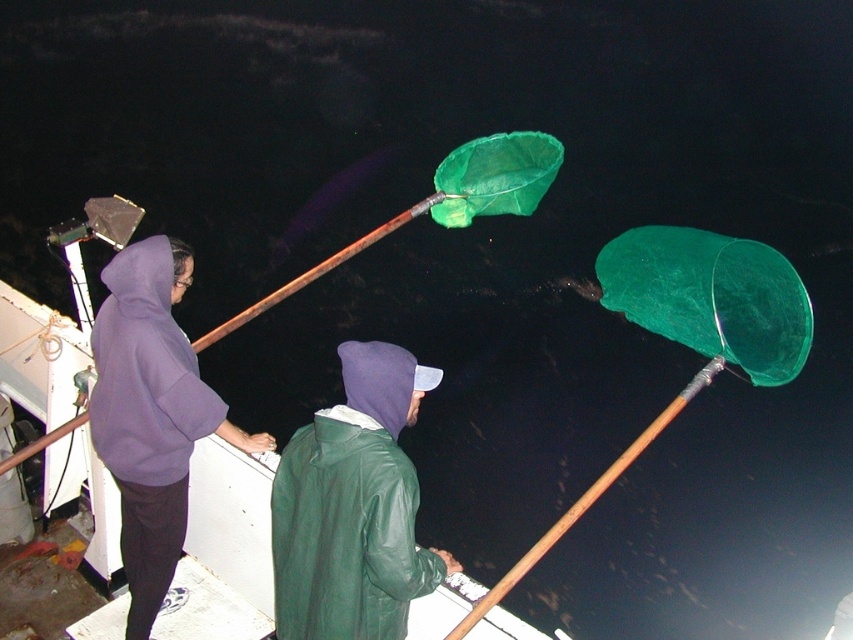
Based on the coordinates provided, which object corresponds to the point at (151, 413) in the nighttime boat scene?

The point at (151, 413) corresponds to the purple hoodie at left.

You are on a boat at night. You see a green matte jacket at center and a green fabric net at left. Which object is taller?

The green matte jacket at center is taller than the green fabric net at left.

You are on a boat at night and need to determine which object takes up more horizontal space. Based on the scene, which one is wider between the green matte jacket at center and the green fabric net at left?

The green fabric net at left is wider than the green matte jacket at center.